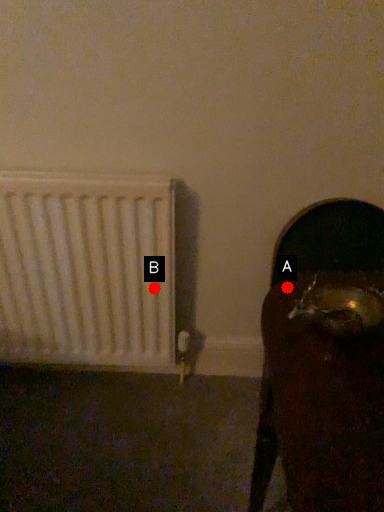
Question: Two points are circled on the image, labeled by A and B beside each circle. Which point is farther from the camera taking this photo?

Choices:
 (A) A is further
 (B) B is further

Answer: (B)